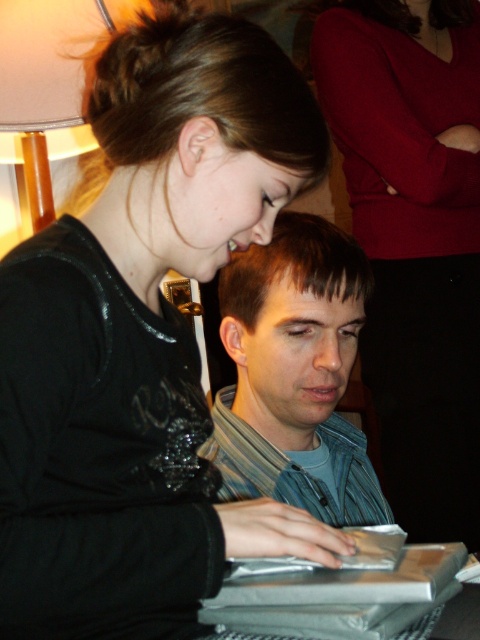
Question: Which point is closer to the camera?

Choices:
 (A) white fabric lampshade at upper left
 (B) denim jacket at center
 (C) matte black sweater at upper left

Answer: (A)

Question: Where is black leather jacket at upper left located in relation to denim jacket at center in the image?

Choices:
 (A) below
 (B) above

Answer: (B)

Question: Does black leather jacket at upper left lie behind white fabric lampshade at upper left?

Choices:
 (A) yes
 (B) no

Answer: (B)

Question: Which object is farther from the camera taking this photo?

Choices:
 (A) white fabric lampshade at upper left
 (B) denim jacket at center
 (C) matte black sweater at upper left
 (D) black leather jacket at upper left

Answer: (C)

Question: Is black leather jacket at upper left in front of denim jacket at center?

Choices:
 (A) yes
 (B) no

Answer: (A)

Question: Which object is positioned closest to the denim jacket at center?

Choices:
 (A) black leather jacket at upper left
 (B) matte black sweater at upper left

Answer: (A)